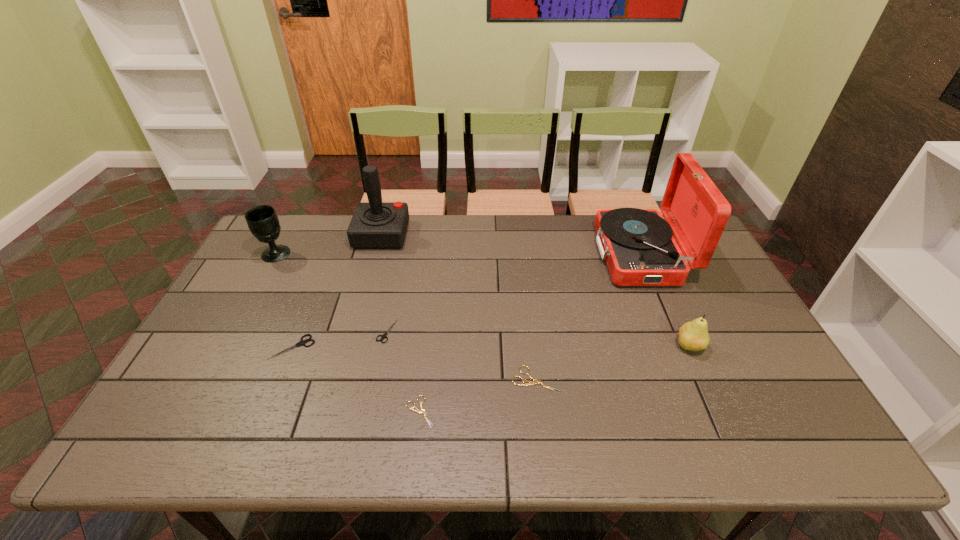
At what (x,y) coordinates should I click in order to perform the action: click on phonograph_record. Please return your answer as a coordinate pair (x, y). The height and width of the screenshot is (540, 960). Looking at the image, I should click on (638, 246).

Where is `joystick`? The height and width of the screenshot is (540, 960). joystick is located at coordinates (375, 224).

The height and width of the screenshot is (540, 960). Find the location of `the leftmost object`. the leftmost object is located at coordinates (262, 220).

At what (x,y) coordinates should I click in order to perform the action: click on chalice. Please return your answer as a coordinate pair (x, y). This screenshot has width=960, height=540. Looking at the image, I should click on (262, 220).

Where is `pear`? pear is located at coordinates (693, 335).

I want to click on the second object from left to right, so click(302, 342).

What are the coordinates of `the left black shears` in the screenshot? It's located at (302, 342).

At what (x,y) coordinates should I click in order to perform the action: click on the third object from right to left. Please return your answer as a coordinate pair (x, y). The width and height of the screenshot is (960, 540). Looking at the image, I should click on (535, 381).

The height and width of the screenshot is (540, 960). I want to click on the right beige shears, so click(x=535, y=381).

This screenshot has height=540, width=960. Find the location of `the right black shears`. the right black shears is located at coordinates (384, 335).